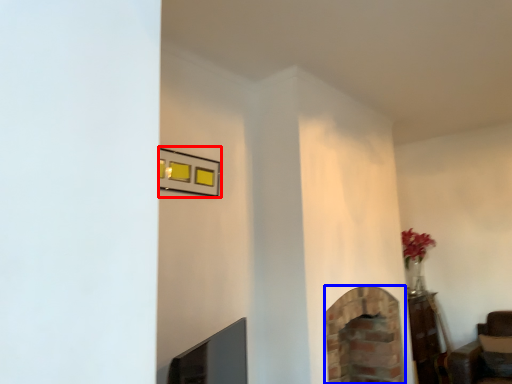
Question: Which object appears closest to the camera in this image, picture frame (highlighted by a red box) or fireplace (highlighted by a blue box)?

Choices:
 (A) picture frame
 (B) fireplace

Answer: (A)